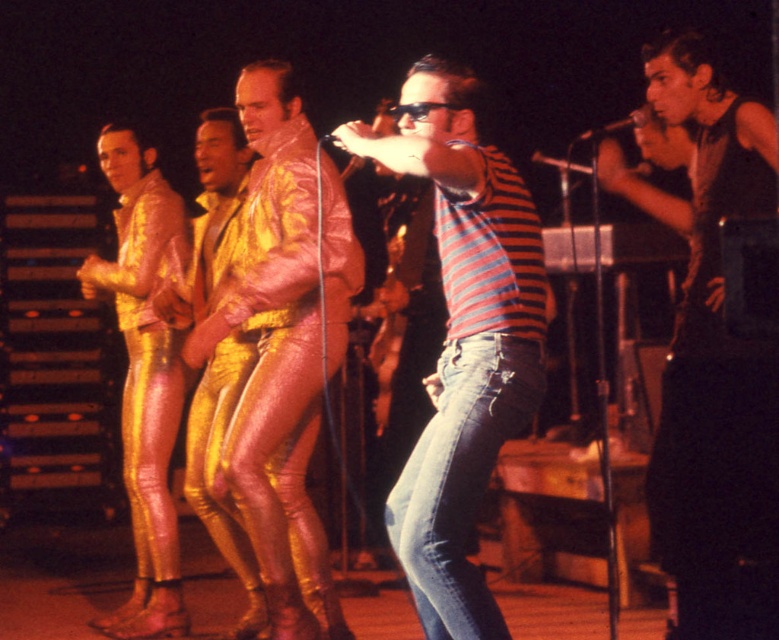
Question: Which is nearer to the gold shiny pants at left?

Choices:
 (A) metallic gold pants at center
 (B) striped cotton shirt at center

Answer: (A)

Question: Observing the image, what is the correct spatial positioning of metallic gold suit at center in reference to metallic gold pants at center?

Choices:
 (A) above
 (B) below

Answer: (A)

Question: Among these points, which one is farthest from the camera?

Choices:
 (A) (629, 113)
 (B) (661, 92)
 (C) (252, 625)

Answer: (A)

Question: Is striped cotton shirt at center bigger than gold shiny pants at left?

Choices:
 (A) no
 (B) yes

Answer: (B)

Question: Which point is closer to the camera?

Choices:
 (A) striped cotton shirt at center
 (B) metallic gold pants at center

Answer: (A)

Question: Is striped cotton shirt at center smaller than metallic silver microphone at upper center?

Choices:
 (A) no
 (B) yes

Answer: (A)